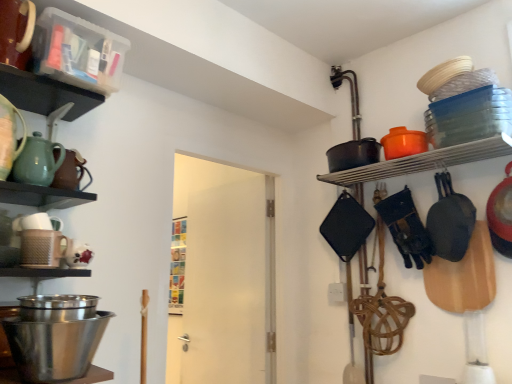
In the scene shown: What is the approximate height of matte green teapot at left, which is the 2th tea pot in back-to-front order?

It is 7.04 inches.

Image resolution: width=512 pixels, height=384 pixels. What do you see at coordinates (71, 172) in the screenshot? I see `matte brown teapot at left, the 1th tea pot from the back` at bounding box center [71, 172].

This screenshot has height=384, width=512. What do you see at coordinates (67, 65) in the screenshot?
I see `clear plastic container at upper left, the 1th shelf positioned from the front` at bounding box center [67, 65].

Find the location of `matte green teapot at left, which is the 2th tea pot in back-to-front order`. matte green teapot at left, which is the 2th tea pot in back-to-front order is located at coordinates (37, 161).

Does matte brown teapot at left, the 1th tea pot from the back, come in front of polished stainless steel mixing bowl at lower left?

No, it is behind polished stainless steel mixing bowl at lower left.

Which of these two, matte brown teapot at left, which is the 2th tea pot from front to back, or polished stainless steel mixing bowl at lower left, is smaller?

matte brown teapot at left, which is the 2th tea pot from front to back, is smaller.

Which object is positioned more to the left, matte brown teapot at left, which is the 2th tea pot from front to back, or polished stainless steel mixing bowl at lower left?

Positioned to the left is matte brown teapot at left, which is the 2th tea pot from front to back.

Is matte black pot at upper right, placed as the second shelf when sorted from front to back, placed right next to black matte frying pan at right?

No, matte black pot at upper right, placed as the second shelf when sorted from front to back, is not next to black matte frying pan at right.

Considering the positions of objects matte black pot at upper right, placed as the second shelf when sorted from top to bottom, and black matte frying pan at right in the image provided, who is in front, matte black pot at upper right, placed as the second shelf when sorted from top to bottom, or black matte frying pan at right?

matte black pot at upper right, placed as the second shelf when sorted from top to bottom.

Which object is thinner, matte black pot at upper right, which is the 2th shelf from left to right, or black matte frying pan at right?

With smaller width is black matte frying pan at right.

Can you confirm if matte black pot at upper right, which is the 2th shelf from left to right, is bigger than black matte frying pan at right?

No, matte black pot at upper right, which is the 2th shelf from left to right, is not bigger than black matte frying pan at right.

From the image's perspective, relative to matte green teapot at left, which is the 2th tea pot in back-to-front order, is clear plastic container at upper left, arranged as the second shelf when viewed from the right, above or below?

clear plastic container at upper left, arranged as the second shelf when viewed from the right, is above matte green teapot at left, which is the 2th tea pot in back-to-front order.

Considering the sizes of clear plastic container at upper left, arranged as the second shelf when viewed from the right, and matte green teapot at left, which is the 2th tea pot in back-to-front order, in the image, is clear plastic container at upper left, arranged as the second shelf when viewed from the right, taller or shorter than matte green teapot at left, which is the 2th tea pot in back-to-front order,?

Clearly, clear plastic container at upper left, arranged as the second shelf when viewed from the right, is taller compared to matte green teapot at left, which is the 2th tea pot in back-to-front order.

Which of these two, clear plastic container at upper left, the first shelf positioned from the top, or matte green teapot at left, which ranks as the 1th tea pot in front-to-back order, is thinner?

matte green teapot at left, which ranks as the 1th tea pot in front-to-back order, is thinner.

Would you consider matte green teapot at left, which ranks as the 1th tea pot in front-to-back order, to be distant from black matte frying pan at right?

Yes, matte green teapot at left, which ranks as the 1th tea pot in front-to-back order, and black matte frying pan at right are quite far apart.

Based on the photo, from the image's perspective, which is above, matte green teapot at left, which is the 2th tea pot in back-to-front order, or black matte frying pan at right?

matte green teapot at left, which is the 2th tea pot in back-to-front order, appears higher in the image.

Which object is closer to the camera taking this photo, matte green teapot at left, which is the 2th tea pot in back-to-front order, or black matte frying pan at right?

matte green teapot at left, which is the 2th tea pot in back-to-front order, is more forward.

Is matte green teapot at left, which ranks as the 1th tea pot in front-to-back order, spatially inside black matte frying pan at right, or outside of it?

matte green teapot at left, which ranks as the 1th tea pot in front-to-back order, is spatially situated outside black matte frying pan at right.

Who is shorter, matte black pot at upper right, placed as the second shelf when sorted from front to back, or clear plastic container at upper left, which appears as the second shelf when ordered from the bottom?

With less height is matte black pot at upper right, placed as the second shelf when sorted from front to back.

Considering the relative positions of matte black pot at upper right, which is the first shelf in right-to-left order, and clear plastic container at upper left, arranged as the 2th shelf when viewed from the back, in the image provided, is matte black pot at upper right, which is the first shelf in right-to-left order, to the left or to the right of clear plastic container at upper left, arranged as the 2th shelf when viewed from the back,?

matte black pot at upper right, which is the first shelf in right-to-left order, is positioned on clear plastic container at upper left, arranged as the 2th shelf when viewed from the back,'s right side.

Would you consider matte black pot at upper right, which is the 2th shelf from left to right, to be distant from clear plastic container at upper left, which appears as the second shelf when ordered from the bottom?

Yes, matte black pot at upper right, which is the 2th shelf from left to right, and clear plastic container at upper left, which appears as the second shelf when ordered from the bottom, are quite far apart.

Between matte brown teapot at left, the 1th tea pot from the back, and black matte frying pan at right, which one appears on the right side from the viewer's perspective?

black matte frying pan at right is more to the right.

Relative to black matte frying pan at right, is matte brown teapot at left, which is the 2th tea pot from front to back, in front or behind?

Visually, matte brown teapot at left, which is the 2th tea pot from front to back, is located in front of black matte frying pan at right.

Is the surface of matte brown teapot at left, which is the 2th tea pot from front to back, in direct contact with black matte frying pan at right?

No, matte brown teapot at left, which is the 2th tea pot from front to back, is not with black matte frying pan at right.

Would you say matte brown teapot at left, the 1th tea pot from the back, is outside black matte frying pan at right?

Yes, matte brown teapot at left, the 1th tea pot from the back, is located beyond the bounds of black matte frying pan at right.

Starting from the matte green teapot at left, which is the 2th tea pot in back-to-front order, which shelf is the 1st one behind? Please provide its 2D coordinates.

[(67, 65)]

Which is nearer, [39,144] or [95,87]?

Point [39,144] is positioned closer to the camera compared to point [95,87].

Between matte green teapot at left, which ranks as the 1th tea pot in front-to-back order, and clear plastic container at upper left, arranged as the 2th shelf when viewed from the back, which one has larger size?

With larger size is clear plastic container at upper left, arranged as the 2th shelf when viewed from the back.

Identify the location of the 1st tea pot above the polished stainless steel mixing bowl at lower left (from a real-world perspective). (71, 172).

From the image's perspective, count 1st shelfs upward from the black matte frying pan at right and point to it. Please provide its 2D coordinates.

[(423, 161)]

When comparing their distances from black matte frying pan at right, does matte brown teapot at left, which is the 2th tea pot from front to back, or polished stainless steel mixing bowl at lower left seem closer?

polished stainless steel mixing bowl at lower left is closer to black matte frying pan at right.

From the picture: Considering their positions, is matte green teapot at left, which ranks as the 1th tea pot in front-to-back order, positioned further to polished stainless steel mixing bowl at lower left than black matte frying pan at right?

Among the two, black matte frying pan at right is located further to polished stainless steel mixing bowl at lower left.

Based on their spatial positions, is matte green teapot at left, which ranks as the 1th tea pot in front-to-back order, or matte black pot at upper right, which is the 2th shelf from left to right, closer to matte brown teapot at left, which is the 2th tea pot from front to back?

Among the two, matte green teapot at left, which ranks as the 1th tea pot in front-to-back order, is located nearer to matte brown teapot at left, which is the 2th tea pot from front to back.

Which object lies further to the anchor point matte brown teapot at left, the 1th tea pot from the back, matte green teapot at left, which ranks as the 1th tea pot in front-to-back order, or black matte frying pan at right?

black matte frying pan at right.

Considering their positions, is black matte frying pan at right positioned further to clear plastic container at upper left, which is the 1th shelf in left-to-right order, than matte green teapot at left, which is the 2th tea pot in back-to-front order?

black matte frying pan at right is further to clear plastic container at upper left, which is the 1th shelf in left-to-right order.

Looking at the image, which one is located further to matte black pot at upper right, which is the 2th shelf from left to right, matte green teapot at left, which is the 2th tea pot in back-to-front order, or matte brown teapot at left, the 1th tea pot from the back?

The object further to matte black pot at upper right, which is the 2th shelf from left to right, is matte green teapot at left, which is the 2th tea pot in back-to-front order.

Based on their spatial positions, is matte green teapot at left, which is the 2th tea pot in back-to-front order, or black matte frying pan at right further from clear plastic container at upper left, the 1th shelf positioned from the front?

black matte frying pan at right is positioned further to the anchor clear plastic container at upper left, the 1th shelf positioned from the front.

Considering their positions, is matte brown teapot at left, which is the 2th tea pot from front to back, positioned closer to polished stainless steel mixing bowl at lower left than matte green teapot at left, which ranks as the 1th tea pot in front-to-back order?

matte green teapot at left, which ranks as the 1th tea pot in front-to-back order, lies closer to polished stainless steel mixing bowl at lower left than the other object.

Locate an element on the screen. This screenshot has height=384, width=512. tea pot that lies between clear plastic container at upper left, the 1th shelf positioned from the front, and matte brown teapot at left, which is the 2th tea pot from front to back, from top to bottom is located at coordinates (37, 161).

The height and width of the screenshot is (384, 512). In order to click on shelf between polished stainless steel mixing bowl at lower left and black matte frying pan at right in the horizontal direction in this screenshot , I will do `click(423, 161)`.

Identify the location of mixing bowl between matte brown teapot at left, which is the 2th tea pot from front to back, and matte black pot at upper right, which is the first shelf in right-to-left order, in the horizontal direction. (54, 347).

You are a GUI agent. You are given a task and a screenshot of the screen. Output one action in this format:
    pyautogui.click(x=<x>, y=<y>)
    Task: Click on the tea pot between matte green teapot at left, which is the 2th tea pot in back-to-front order, and black matte frying pan at right from left to right
    
    Given the screenshot: What is the action you would take?
    pyautogui.click(x=71, y=172)